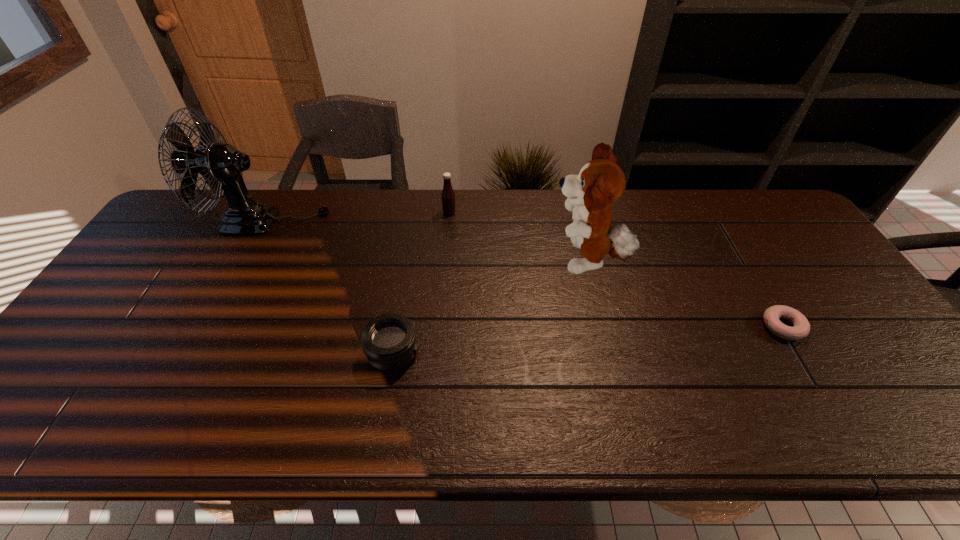
At what (x,y) coordinates should I click in order to perform the action: click on vacant space at the near edge of the desktop. Please return your answer as a coordinate pair (x, y). This screenshot has width=960, height=540. Looking at the image, I should click on (411, 438).

Find the location of `vacant area at the left edge`. vacant area at the left edge is located at coordinates (129, 345).

The image size is (960, 540). In order to click on vacant space at the right edge of the desktop in this screenshot , I will do `click(804, 262)`.

At what (x,y) coordinates should I click in order to perform the action: click on vacant space at the far left corner of the desktop. Please return your answer as a coordinate pair (x, y). The height and width of the screenshot is (540, 960). Looking at the image, I should click on (190, 232).

Image resolution: width=960 pixels, height=540 pixels. Find the location of `free space at the near left corner`. free space at the near left corner is located at coordinates (55, 415).

In order to click on vacant area that lies between the fourth tallest object and the doughnut in this screenshot , I will do `click(588, 340)`.

Locate an element on the screen. The width and height of the screenshot is (960, 540). empty location between the rightmost object and the third shortest object is located at coordinates (616, 269).

Image resolution: width=960 pixels, height=540 pixels. I want to click on empty space between the puppy and the rightmost object, so click(684, 294).

This screenshot has height=540, width=960. Identify the location of vacant space that's between the leftmost object and the doughnut. (525, 274).

Find the location of a particular element. This screenshot has width=960, height=540. empty location between the telephoto lens and the leftmost object is located at coordinates (330, 287).